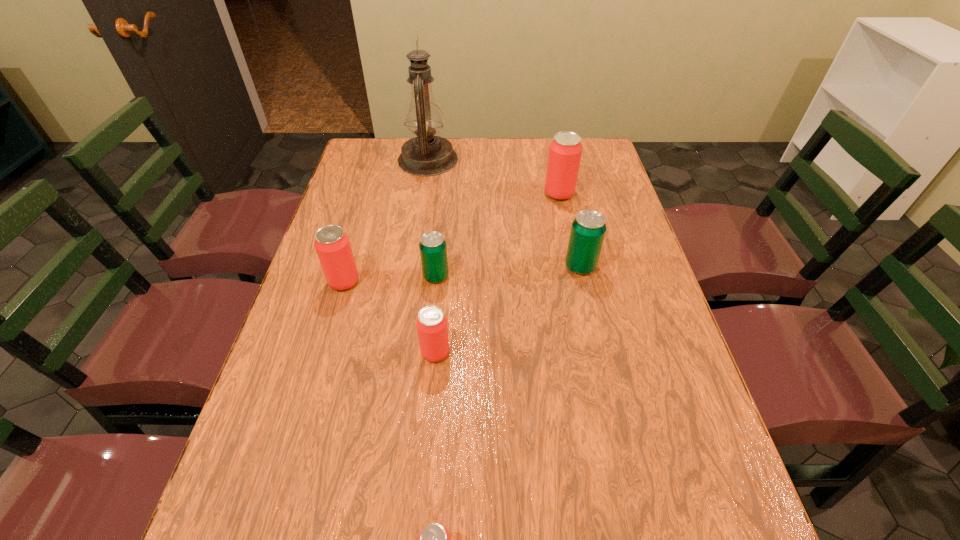
Find the location of a particular element. This screenshot has height=540, width=960. the farthest object is located at coordinates (425, 155).

The height and width of the screenshot is (540, 960). Find the location of `oil lamp`. oil lamp is located at coordinates (425, 155).

Identify the location of the farthest red beer can. click(x=565, y=151).

Find the location of a particular element. This screenshot has height=540, width=960. the farthest beer can is located at coordinates (565, 151).

The width and height of the screenshot is (960, 540). What are the coordinates of `the leftmost red beer can` in the screenshot? It's located at (332, 244).

The image size is (960, 540). I want to click on the leftmost object, so click(332, 244).

Where is `the right teal beer can`? This screenshot has height=540, width=960. the right teal beer can is located at coordinates (588, 229).

Identify the location of the left teal beer can. (433, 250).

Where is `the third biggest red beer can`? the third biggest red beer can is located at coordinates (431, 323).

The width and height of the screenshot is (960, 540). What are the coordinates of `the second nearest red beer can` in the screenshot? It's located at (431, 323).